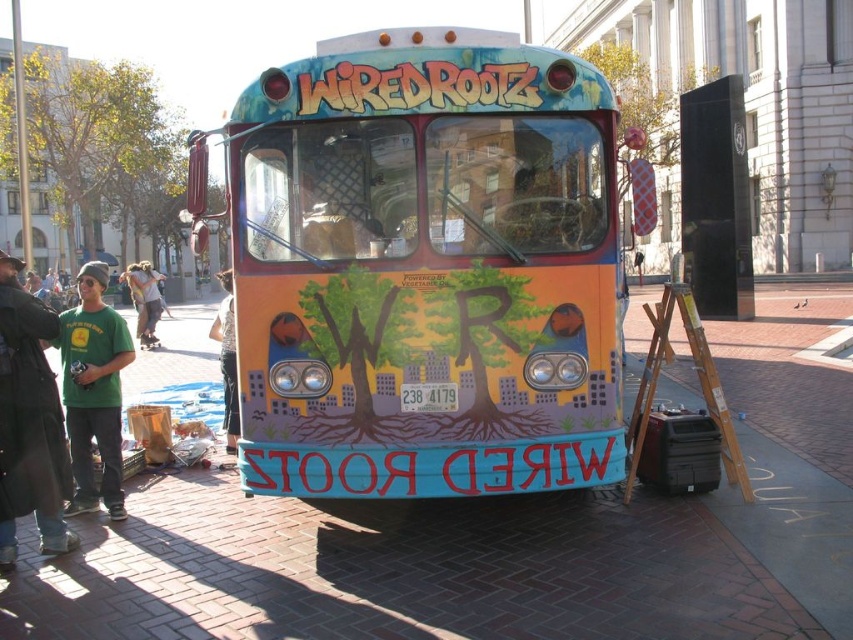
Question: Does brick pavement at center have a lesser width compared to green cotton shirt at left?

Choices:
 (A) yes
 (B) no

Answer: (B)

Question: Which of the following is the closest to the observer?

Choices:
 (A) (503, 109)
 (B) (144, 291)

Answer: (A)

Question: Does matte painted bus at center appear on the right side of brick pavement at center?

Choices:
 (A) no
 (B) yes

Answer: (B)

Question: Estimate the real-world distances between objects in this image. Which object is farther from the green cotton t-shirt at left?

Choices:
 (A) matte painted bus at center
 (B) light brown leather jacket at center

Answer: (B)

Question: Does matte painted bus at center have a lesser width compared to denim jacket at lower left?

Choices:
 (A) yes
 (B) no

Answer: (A)

Question: Which point is farther to the camera?

Choices:
 (A) denim jacket at lower left
 (B) green cotton t-shirt at left
 (C) light brown leather jacket at center

Answer: (C)